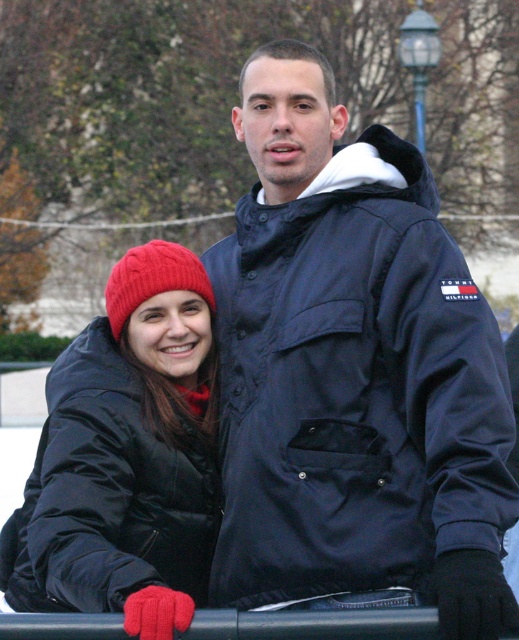
Is matte black coat at lower left closer to the viewer compared to cable-knit woolen beanie at left?

Yes, it is in front of cable-knit woolen beanie at left.

Is matte black coat at lower left positioned behind cable-knit woolen beanie at left?

No.

Is point (151, 250) closer to viewer compared to point (125, 276)?

No.

Where is `matte black coat at lower left`? The image size is (519, 640). matte black coat at lower left is located at coordinates tap(126, 458).

Who is more distant from viewer, [381,205] or [158,259]?

Positioned behind is point [158,259].

Which of these two, navy blue jacket at center or cable-knit woolen beanie at left, stands shorter?

With less height is cable-knit woolen beanie at left.

Which is in front, point (372, 170) or point (177, 268)?

Positioned in front is point (372, 170).

Find the location of `navy blue jacket at center`. navy blue jacket at center is located at coordinates (352, 374).

Does navy blue jacket at center appear over matte black coat at lower left?

Correct, navy blue jacket at center is located above matte black coat at lower left.

Is navy blue jacket at center smaller than matte black coat at lower left?

No.

Find the location of a particular element. The image size is (519, 640). navy blue jacket at center is located at coordinates (352, 374).